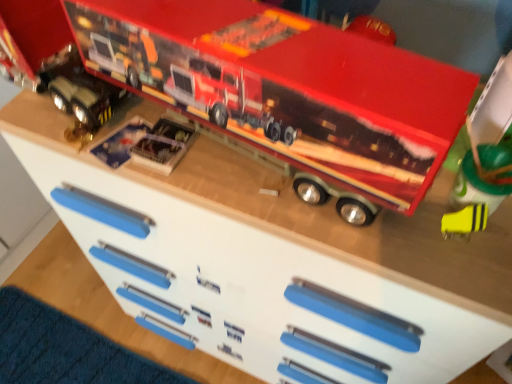
At what (x,y) coordinates should I click in order to perform the action: click on vacant space to the left of yellow matte eraser at lower right, which is the fourth toy from left to right. Please return your answer as a coordinate pair (x, y). The height and width of the screenshot is (384, 512). Looking at the image, I should click on (349, 231).